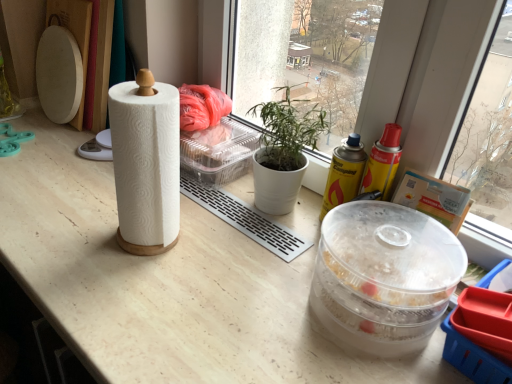
Describe the element at coordinates (283, 151) in the screenshot. I see `white matte pot at center` at that location.

Where is `white matte pot at center`? white matte pot at center is located at coordinates (283, 151).

The width and height of the screenshot is (512, 384). Find the location of `white matte pot at center`. white matte pot at center is located at coordinates (283, 151).